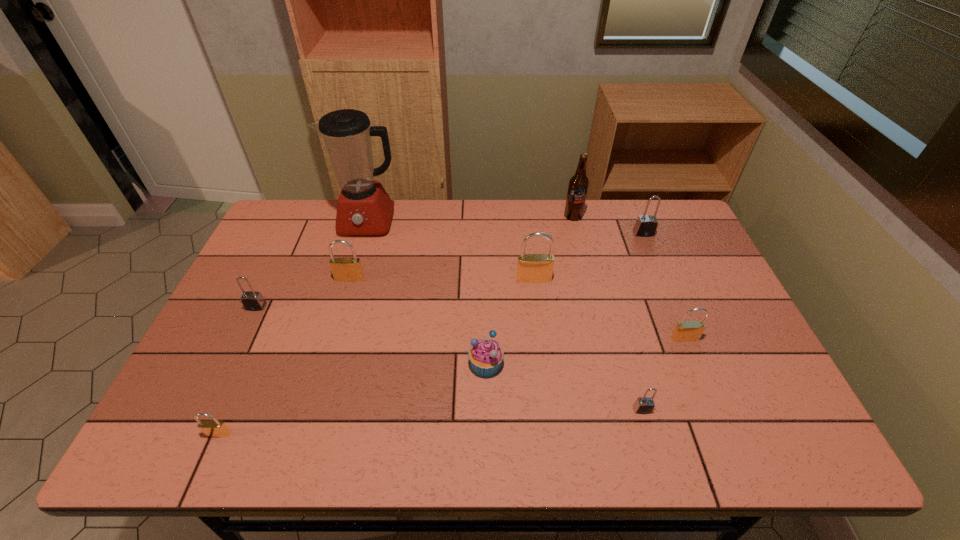
The width and height of the screenshot is (960, 540). Identify the location of brass padlock that can be found as the second closest to the tallest object. (531, 268).

Identify which gray padlock is the third nearest to the third padlock from left to right. Please provide its 2D coordinates. Your answer should be formatted as a tuple, i.e. [(x, y)], where the tuple contains the x and y coordinates of a point satisfying the conditions above.

[(646, 225)]

Locate an element on the screen. The image size is (960, 540). the third closest gray padlock relative to the blue muffin is located at coordinates (646, 225).